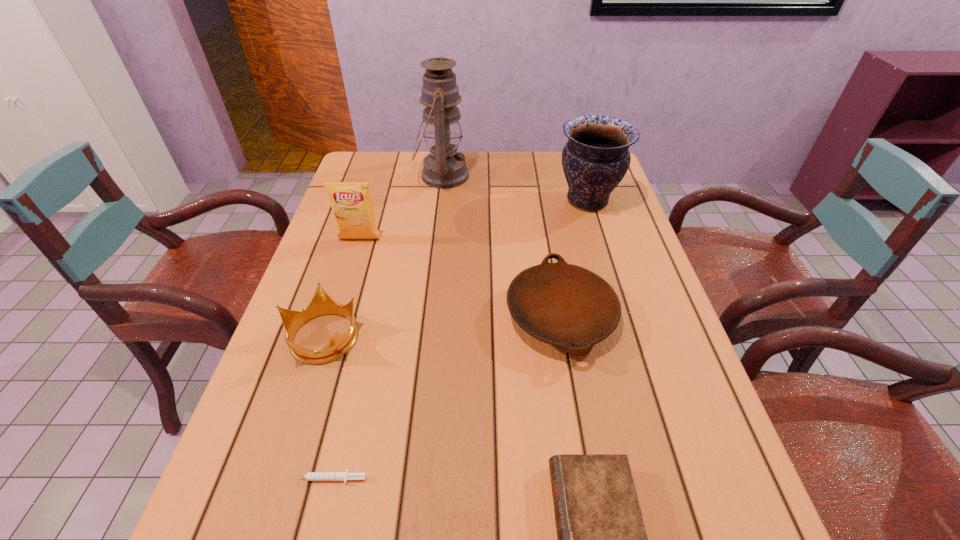
You are a GUI agent. You are given a task and a screenshot of the screen. Output one action in this format:
    pyautogui.click(x=<x>, y=<y>)
    Task: Click on the free point located 0.380m on the front handle of the sixth shortest object
    This screenshot has width=960, height=540.
    Given the screenshot: What is the action you would take?
    pyautogui.click(x=431, y=200)

Where is `vacant space located on the front of the third farthest object with the logo`? The width and height of the screenshot is (960, 540). vacant space located on the front of the third farthest object with the logo is located at coordinates (353, 258).

Find the location of a particular element. The width and height of the screenshot is (960, 540). vacant space located on the right of the crown is located at coordinates (498, 336).

Identify the location of vacant space located 0.340m on the left of the plate. This screenshot has width=960, height=540. (360, 316).

Identify the location of vacant area situated on the back of the syringe. This screenshot has width=960, height=540. (357, 354).

You are a GUI agent. You are given a task and a screenshot of the screen. Output one action in this format:
    pyautogui.click(x=<x>, y=<y>)
    Task: Click on the oil lamp positioned at the far edge
    
    Given the screenshot: What is the action you would take?
    pyautogui.click(x=444, y=168)

I want to click on pottery located at the far edge, so click(595, 159).

Find the location of a particular element. crisp (potato chip) present at the left edge is located at coordinates (351, 203).

I want to click on crown that is at the left edge, so click(x=321, y=304).

Identify the location of syringe that is at the left edge. (310, 476).